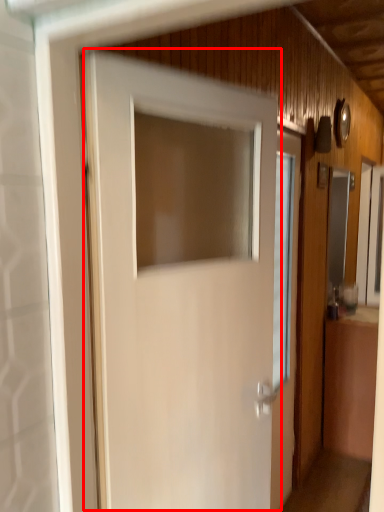
Question: From the image's perspective, where is door (annotated by the red box) located in relation to window in the image?

Choices:
 (A) above
 (B) below

Answer: (B)